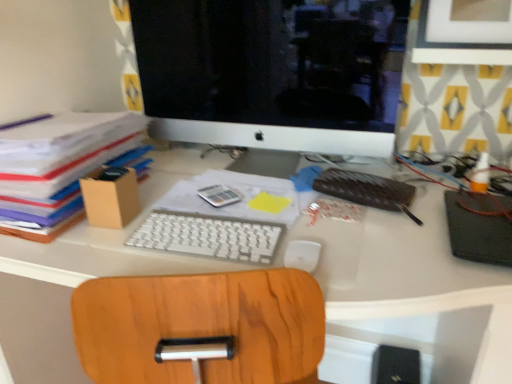
Question: Would you say white matte mouse at center is part of leather-bound notebook at center-right, the 1th notebook in the left-to-right sequence,'s contents?

Choices:
 (A) yes
 (B) no

Answer: (B)

Question: From the image's perspective, does leather-bound notebook at center-right, the second notebook from the right, appear higher than white matte mouse at center?

Choices:
 (A) yes
 (B) no

Answer: (A)

Question: Is leather-bound notebook at center-right, the 1th notebook in the left-to-right sequence, completely or partially outside of white matte mouse at center?

Choices:
 (A) no
 (B) yes

Answer: (B)

Question: Can you confirm if leather-bound notebook at center-right, the 1th notebook in the left-to-right sequence, is taller than white matte mouse at center?

Choices:
 (A) no
 (B) yes

Answer: (B)

Question: Is leather-bound notebook at center-right, the second notebook from the right, directly adjacent to white matte mouse at center?

Choices:
 (A) yes
 (B) no

Answer: (B)

Question: Can you confirm if leather-bound notebook at center-right, the 1th notebook in the left-to-right sequence, is wider than white matte mouse at center?

Choices:
 (A) no
 (B) yes

Answer: (B)

Question: Is white glossy computer monitor at upper center smaller than black matte notebook at right, acting as the 1th notebook starting from the right?

Choices:
 (A) yes
 (B) no

Answer: (B)

Question: Is white glossy computer monitor at upper center not near black matte notebook at right, acting as the 1th notebook starting from the right?

Choices:
 (A) no
 (B) yes

Answer: (A)

Question: Is white glossy computer monitor at upper center wider than black matte notebook at right, which ranks as the second notebook in left-to-right order?

Choices:
 (A) yes
 (B) no

Answer: (B)

Question: From the image's perspective, is white glossy computer monitor at upper center over black matte notebook at right, which ranks as the second notebook in left-to-right order?

Choices:
 (A) no
 (B) yes

Answer: (B)

Question: Can you confirm if white glossy computer monitor at upper center is taller than black matte notebook at right, which ranks as the second notebook in left-to-right order?

Choices:
 (A) yes
 (B) no

Answer: (A)

Question: From the image's perspective, would you say white glossy computer monitor at upper center is shown under black matte notebook at right, which ranks as the second notebook in left-to-right order?

Choices:
 (A) no
 (B) yes

Answer: (A)

Question: Is leather-bound notebook at center-right, the 1th notebook in the left-to-right sequence, further to the viewer compared to white plastic keyboard at center?

Choices:
 (A) yes
 (B) no

Answer: (A)